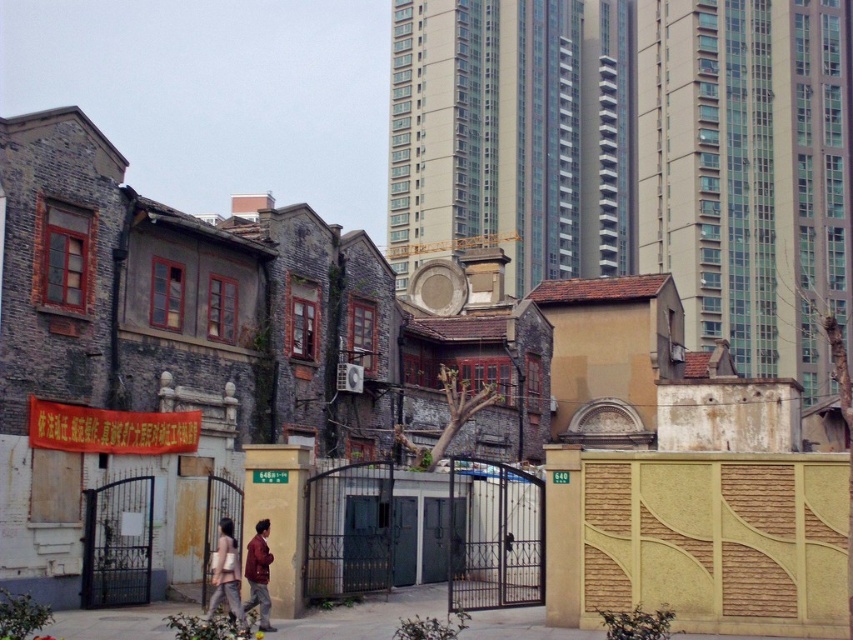
Is light brown leather jacket at center wider than maroon fabric jacket at center?

No.

You are a GUI agent. You are given a task and a screenshot of the screen. Output one action in this format:
    pyautogui.click(x=<x>, y=<y>)
    Task: Click on the light brown leather jacket at center
    The width and height of the screenshot is (853, 640).
    Given the screenshot: What is the action you would take?
    pyautogui.click(x=225, y=573)

This screenshot has height=640, width=853. I want to click on light brown leather jacket at center, so click(225, 573).